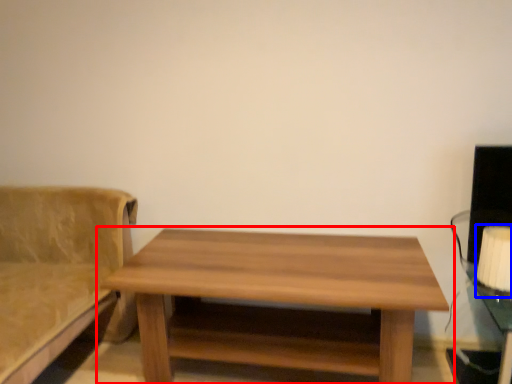
Question: Which of the following is the closest to the observer, table (highlighted by a red box) or table lamp (highlighted by a blue box)?

Choices:
 (A) table
 (B) table lamp

Answer: (A)